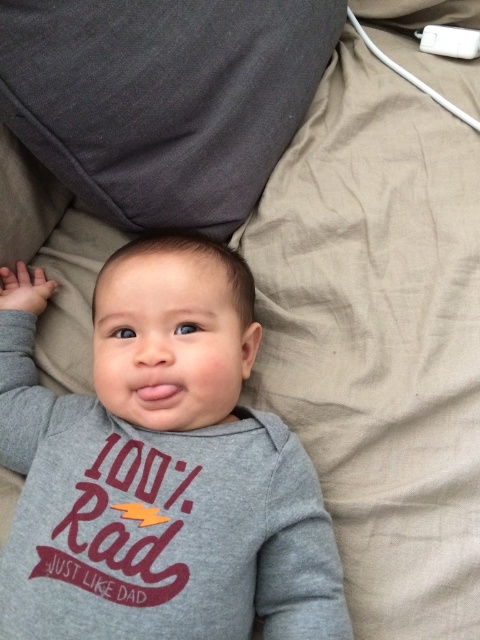
Question: Which of the following is the farthest from the observer?

Choices:
 (A) dark gray fabric pillow at upper center
 (B) gray soft fabric baby at center
 (C) white plastic remote at upper right

Answer: (C)

Question: Among these objects, which one is nearest to the camera?

Choices:
 (A) white plastic remote at upper right
 (B) dark gray fabric pillow at upper center
 (C) gray soft fabric baby at center

Answer: (C)

Question: Considering the relative positions of dark gray fabric pillow at upper center and white plastic remote at upper right in the image provided, where is dark gray fabric pillow at upper center located with respect to white plastic remote at upper right?

Choices:
 (A) left
 (B) right

Answer: (A)

Question: Which of the following is the closest to the observer?

Choices:
 (A) gray soft fabric baby at center
 (B) white plastic remote at upper right

Answer: (A)

Question: Can you confirm if gray soft fabric baby at center is wider than dark gray fabric pillow at upper center?

Choices:
 (A) no
 (B) yes

Answer: (B)

Question: Can you confirm if gray soft fabric baby at center is positioned below dark gray fabric pillow at upper center?

Choices:
 (A) yes
 (B) no

Answer: (A)